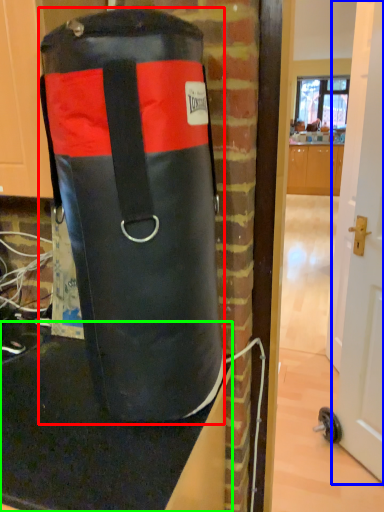
Question: Based on their relative distances, which object is farther from punching bag (highlighted by a red box)? Choose from door (highlighted by a blue box) and table top (highlighted by a green box).

Choices:
 (A) door
 (B) table top

Answer: (A)